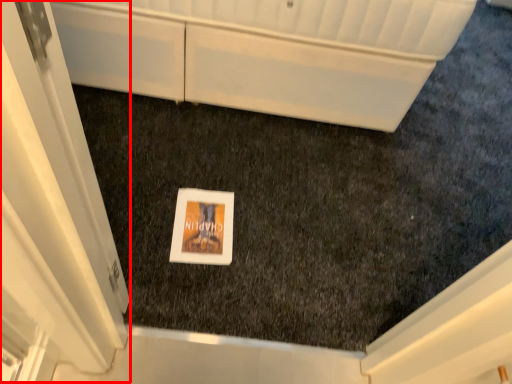
Question: Considering the relative positions of screen door (annotated by the red box) and cabinetry in the image provided, where is screen door (annotated by the red box) located with respect to the staircase?

Choices:
 (A) left
 (B) right

Answer: (A)